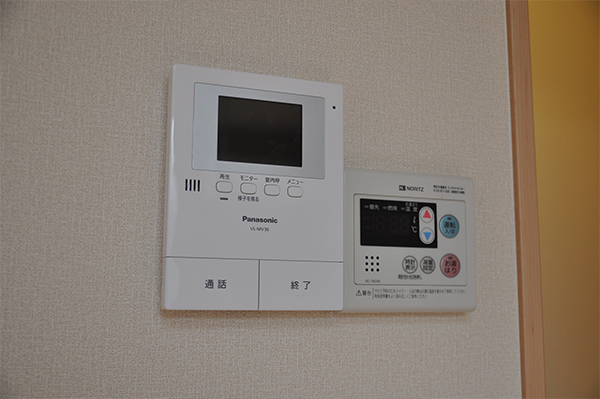
At what (x,y) coordinates should I click in order to perform the action: click on screens. Please return your answer as a coordinate pair (x, y). Image resolution: width=600 pixels, height=399 pixels. Looking at the image, I should click on (255, 126), (379, 231).